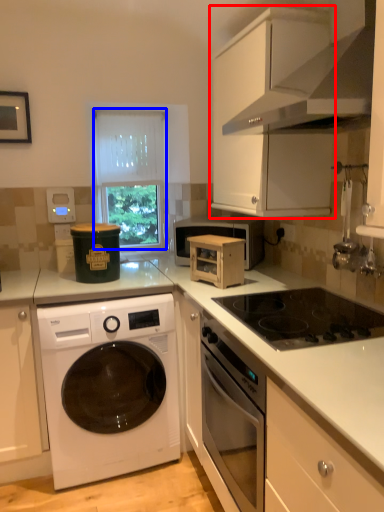
Question: Among these objects, which one is nearest to the camera, cabinetry (highlighted by a red box) or window (highlighted by a blue box)?

Choices:
 (A) cabinetry
 (B) window

Answer: (A)